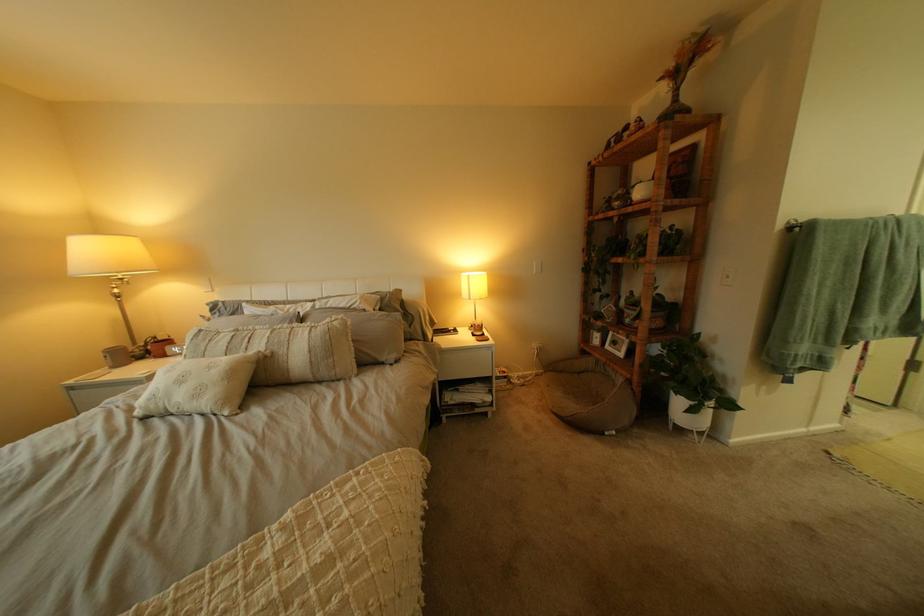
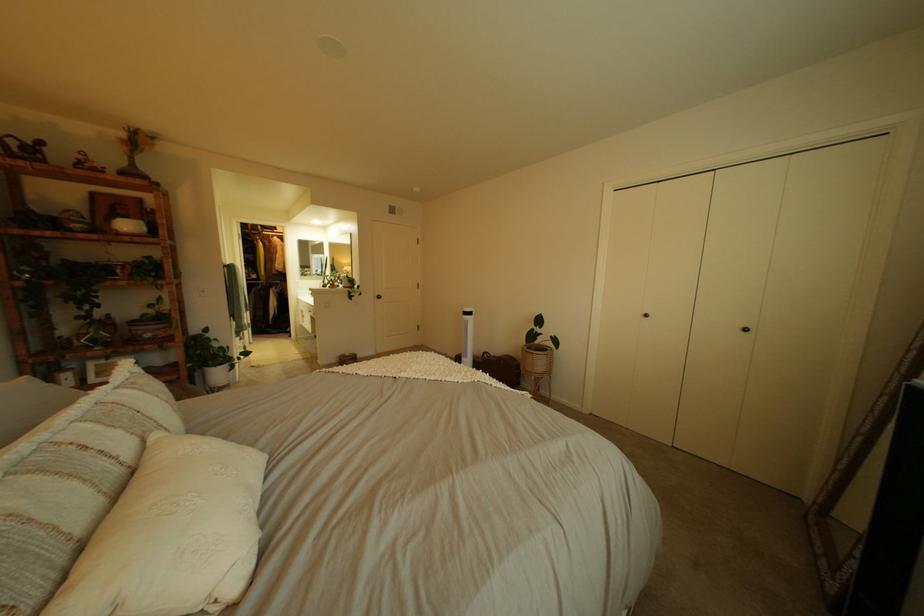
In the second image, find the point that corresponds to (281,342) in the first image.

(134, 434)